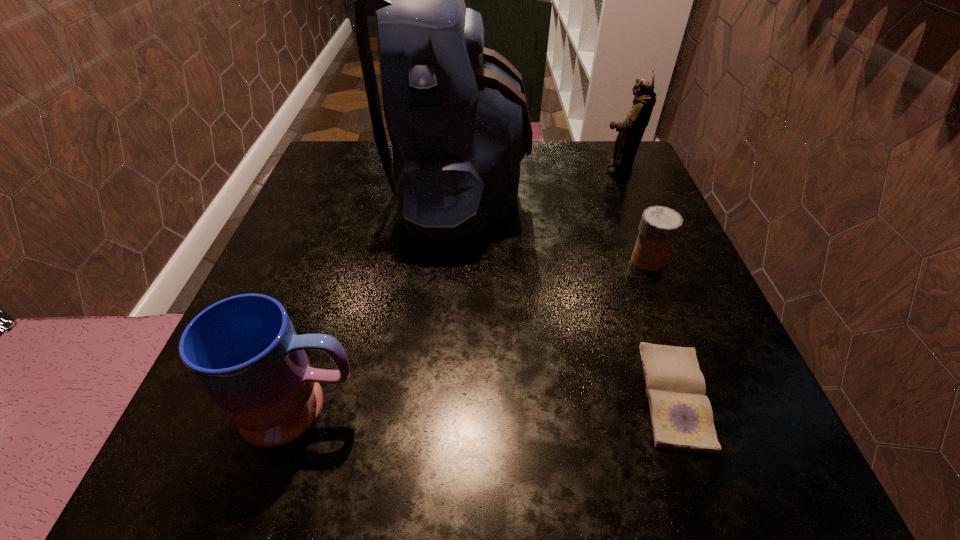
Locate an element on the screen. Image resolution: width=960 pixels, height=540 pixels. vacant region at the far right corner is located at coordinates (597, 156).

Locate an element on the screen. vacant space at the near right corner is located at coordinates (724, 465).

At what (x,y) coordinates should I click in order to perform the action: click on vacant space in between the shortest object and the third tallest object. Please return your answer as a coordinate pair (x, y). Looking at the image, I should click on (489, 402).

Locate an element on the screen. Image resolution: width=960 pixels, height=540 pixels. vacant area between the medicine and the tallest object is located at coordinates (554, 226).

Where is `empty space that is in between the fourth tallest object and the backpack`? The height and width of the screenshot is (540, 960). empty space that is in between the fourth tallest object and the backpack is located at coordinates (554, 226).

The image size is (960, 540). Identify the location of free space between the tallest object and the figurine. (539, 181).

Locate an element on the screen. free space between the tallest object and the fourth tallest object is located at coordinates (554, 226).

Where is `empty space between the mug and the fourth tallest object`? This screenshot has width=960, height=540. empty space between the mug and the fourth tallest object is located at coordinates (475, 334).

Where is `free space between the figurine and the second shortest object`? free space between the figurine and the second shortest object is located at coordinates (633, 215).

Identify the location of free space between the medicine and the tallest object. The height and width of the screenshot is (540, 960). (554, 226).